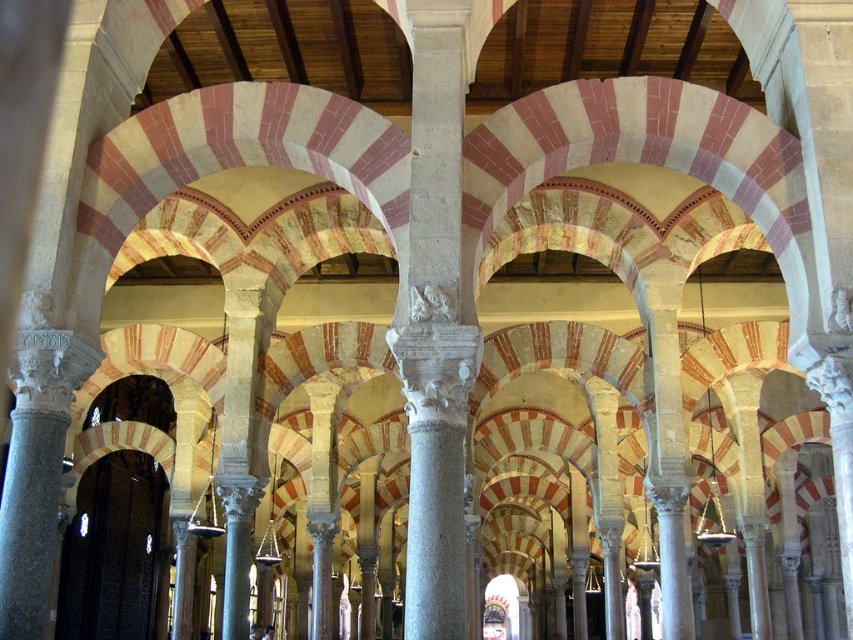
Question: Which object appears closest to the camera in this image?

Choices:
 (A) gray stone column at center
 (B) smooth stone column at center

Answer: (B)

Question: Which point is closer to the camera taking this photo?

Choices:
 (A) (254, 472)
 (B) (457, 449)

Answer: (B)

Question: In this image, where is smooth stone column at center located relative to gray stone column at center?

Choices:
 (A) right
 (B) left

Answer: (A)

Question: Can you confirm if smooth stone column at center is positioned to the left of gray stone column at center?

Choices:
 (A) yes
 (B) no

Answer: (B)

Question: Which point is farther to the camera?

Choices:
 (A) gray stone column at center
 (B) smooth stone column at center

Answer: (A)

Question: Where is smooth stone column at center located in relation to gray stone column at center in the image?

Choices:
 (A) left
 (B) right

Answer: (B)